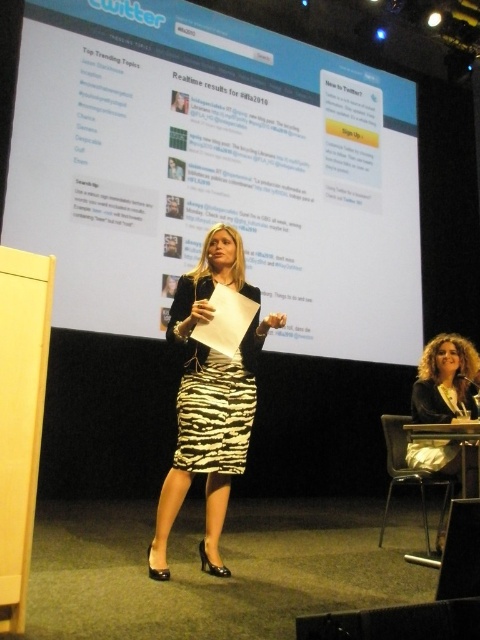
You are an event photographer who needs to capture the speaker in a way that clearly shows both the zebra print dress at center and the curly hair at lower right. Based on their relative sizes in the image, which object should you focus on to ensure both are visible in the frame?

The zebra print dress at center is taller than curly hair at lower right, so focusing on the zebra print dress at center will ensure both are visible since it occupies more vertical space.

You are an event planner setting up the stage for a presentation. You need to place a new speaker stand that will be 1.5 meters tall. The stand must be positioned so that the speaker can easily see the white glossy projection screen at upper center while facing the audience. Based on the scene description, where should you place the speaker stand relative to the screen?

The speaker stand should be placed directly in front of the white glossy projection screen at upper center to ensure the speaker can see the screen clearly while facing the audience.

You are an event photographer at the presentation. You need to capture a clear shot of the speaker while ensuring the zebra print skirt at center and zebra print dress at center are visible. Which clothing item is closer to the camera?

The zebra print skirt at center is positioned under the zebra print dress at center, so the dress is closer to the camera.